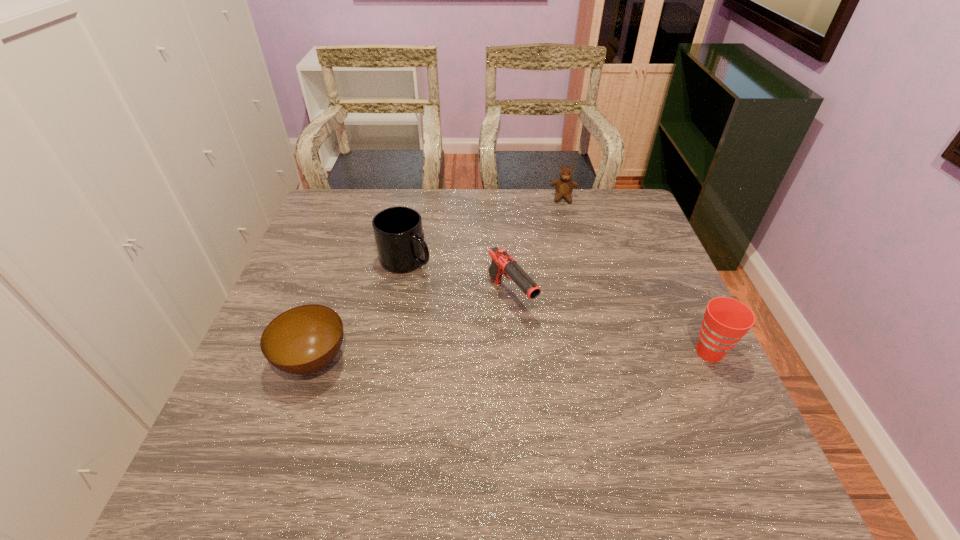
The width and height of the screenshot is (960, 540). I want to click on vacant area located at the face of the second object from right to left, so click(563, 259).

What are the coordinates of `vacant space situated 0.060m at the face of the second object from right to left` in the screenshot? It's located at (563, 215).

Identify the location of free space located with the handle on the side of the mug. (456, 309).

The width and height of the screenshot is (960, 540). I want to click on free space located with the handle on the side of the mug, so click(x=490, y=344).

This screenshot has width=960, height=540. What are the coordinates of `vacant space located 0.170m with the handle on the side of the mug` in the screenshot? It's located at (456, 309).

What are the coordinates of `free location located 0.340m at the aiming end of the gun` in the screenshot? It's located at (620, 434).

Locate an element on the screen. Image resolution: width=960 pixels, height=540 pixels. vacant region located 0.290m at the aiming end of the gun is located at coordinates (604, 414).

Where is `vacant space situated 0.120m at the aiming end of the gun`? The image size is (960, 540). vacant space situated 0.120m at the aiming end of the gun is located at coordinates (554, 355).

Where is `object located in the far edge section of the desktop`? object located in the far edge section of the desktop is located at coordinates (564, 186).

Identify the location of object at the left edge. The height and width of the screenshot is (540, 960). (303, 340).